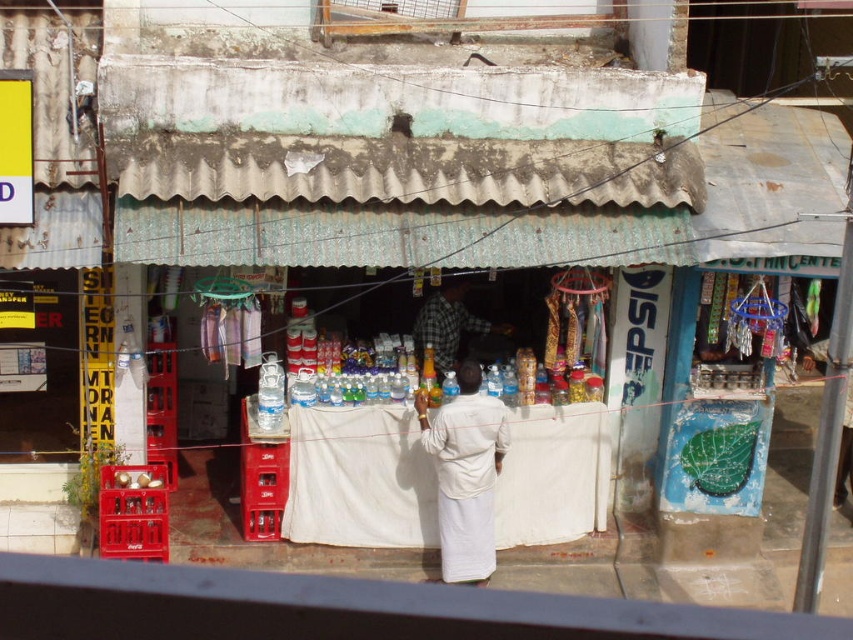
Question: Among these points, which one is farthest from the camera?

Choices:
 (A) (445, 365)
 (B) (451, 467)

Answer: (A)

Question: Can you confirm if white cotton robe at center is positioned to the right of checkered fabric shirt at center?

Choices:
 (A) yes
 (B) no

Answer: (A)

Question: Does white cotton robe at center have a smaller size compared to checkered fabric shirt at center?

Choices:
 (A) yes
 (B) no

Answer: (A)

Question: In this image, where is white cotton robe at center located relative to checkered fabric shirt at center?

Choices:
 (A) right
 (B) left

Answer: (A)